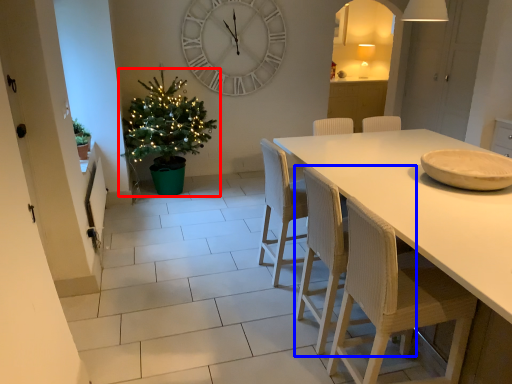
Question: Which object is further to the camera taking this photo, christmas tree (highlighted by a red box) or chair (highlighted by a blue box)?

Choices:
 (A) christmas tree
 (B) chair

Answer: (A)